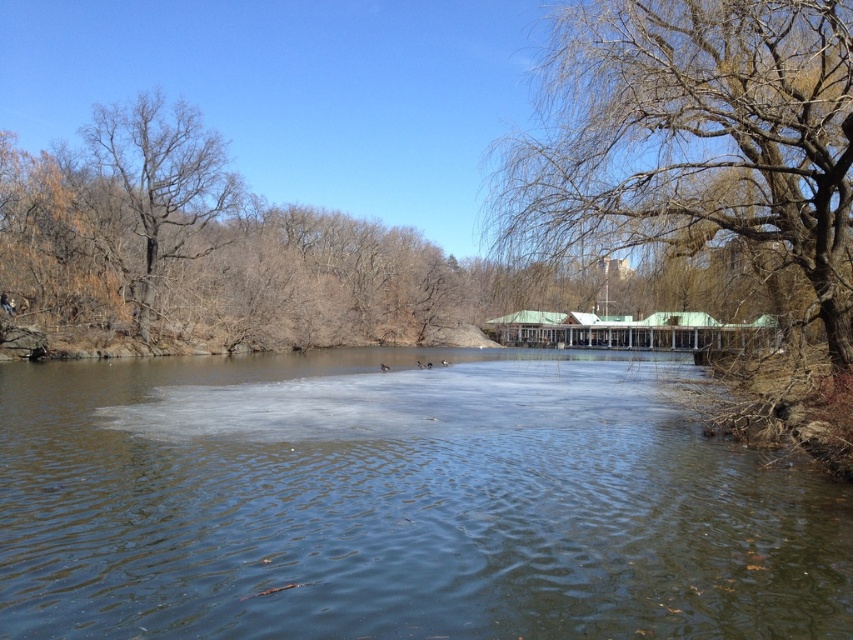
In the scene shown: Can you confirm if clear water at center is positioned above bare branches at upper right?

Actually, clear water at center is below bare branches at upper right.

Does point (248, 513) lie behind point (514, 160)?

That is False.

Is point (251, 621) positioned before point (784, 144)?

Yes, point (251, 621) is closer to viewer.

You are a GUI agent. You are given a task and a screenshot of the screen. Output one action in this format:
    pyautogui.click(x=<x>, y=<y>)
    Task: Click on the clear water at center
    
    Given the screenshot: What is the action you would take?
    pyautogui.click(x=399, y=502)

Can you confirm if clear water at center is shorter than bare branches at left?

Indeed, clear water at center has a lesser height compared to bare branches at left.

Is point (712, 540) positioned behind point (173, 172)?

No.

Locate an element on the screen. clear water at center is located at coordinates (399, 502).

Looking at this image, who is positioned more to the right, bare branches at upper right or bare branches at left?

bare branches at upper right

Is bare branches at upper right closer to the viewer compared to bare branches at left?

Yes, it is.

Which is behind, point (640, 61) or point (146, 312)?

Point (146, 312)

What are the coordinates of `bare branches at upper right` in the screenshot? It's located at (693, 138).